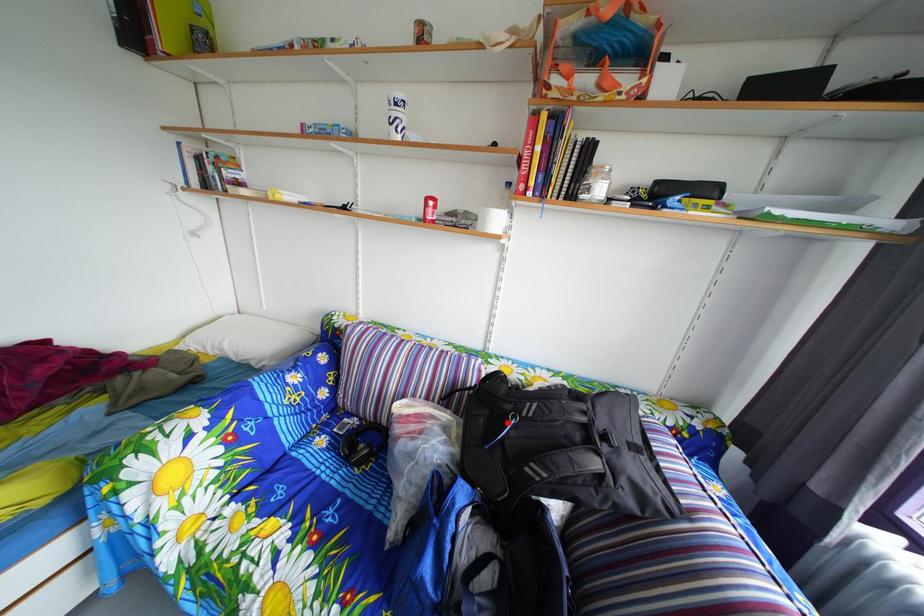
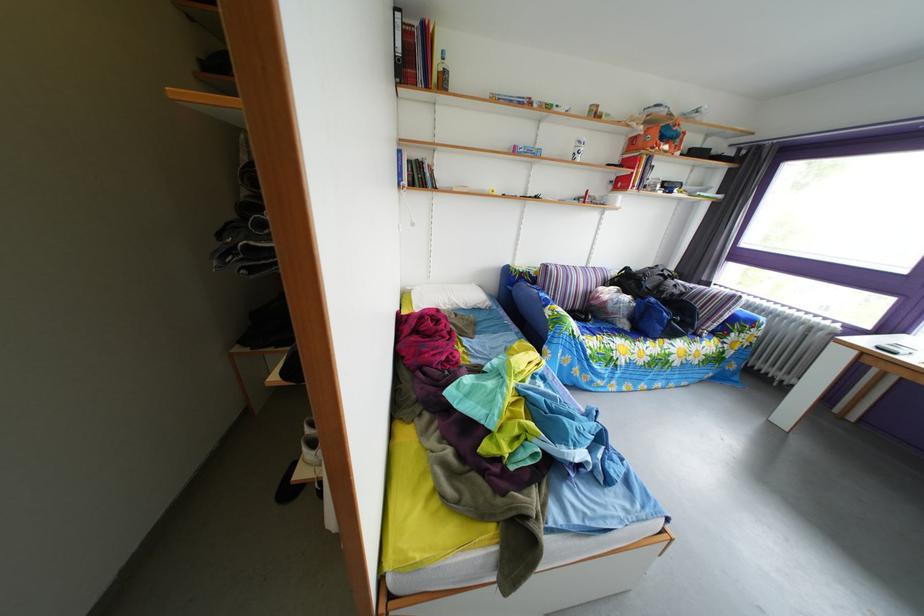
Question: I am providing you with two images of the same scene from different viewpoints. A red point is marked on the first image. Can you still see the location of the red point in image 2?

Choices:
 (A) Yes
 (B) No

Answer: (B)